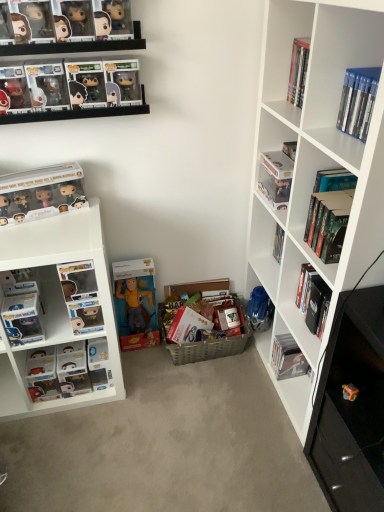
You are a GUI agent. You are given a task and a screenshot of the screen. Output one action in this format:
    pyautogui.click(x=<x>, y=<y>)
    Task: Click on the free space between matte plastic pop vinyl figure at lower left, placed as the 7th book when sorted from right to left, and hardcover book at lower right, the 5th book when ordered from left to right
    This screenshot has height=512, width=384.
    Given the screenshot: What is the action you would take?
    pyautogui.click(x=182, y=377)